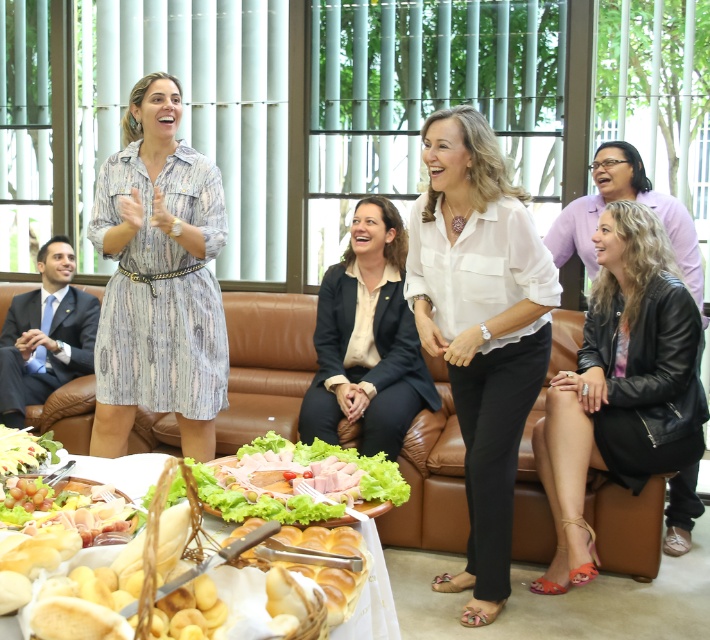
Is brown leather couch at center positioned at the back of white matte bread basket at lower left?

Yes, brown leather couch at center is behind white matte bread basket at lower left.

Measure the distance from brown leather couch at center to white matte bread basket at lower left.

4.67 feet

This screenshot has width=710, height=640. What are the coordinates of `brown leather couch at center` in the screenshot? It's located at (266, 364).

Measure the distance between brown leather couch at center and camera.

brown leather couch at center and camera are 10.50 feet apart from each other.

Can you confirm if brown leather couch at center is positioned below printed fabric dress at center?

Indeed, brown leather couch at center is positioned under printed fabric dress at center.

In the scene shown: Who is more forward, (268, 308) or (207, 300)?

Point (207, 300) is in front.

Locate an element on the screen. Image resolution: width=710 pixels, height=640 pixels. brown leather couch at center is located at coordinates tap(266, 364).

Is printed fabric dress at center wider than matte black blazer at center?

No.

Does printed fabric dress at center appear on the right side of matte black blazer at center?

Incorrect, printed fabric dress at center is not on the right side of matte black blazer at center.

Is point (163, 236) less distant than point (378, 257)?

Yes, it is.

You are a GUI agent. You are given a task and a screenshot of the screen. Output one action in this format:
    pyautogui.click(x=<x>, y=<y>)
    Task: Click on the printed fabric dress at center
    
    Given the screenshot: What is the action you would take?
    pyautogui.click(x=158, y=278)